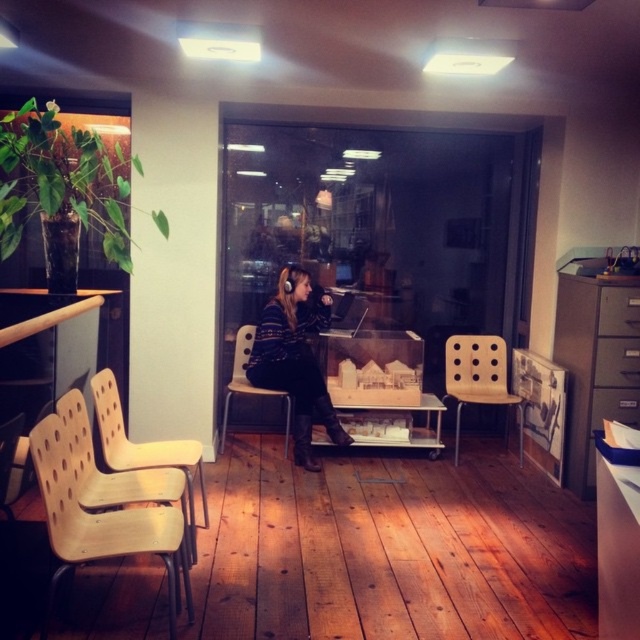
Can you confirm if light brown wood chair at left is positioned above light brown plastic chair at left?

Actually, light brown wood chair at left is below light brown plastic chair at left.

Measure the distance between light brown wood chair at left and camera.

light brown wood chair at left is 3.08 meters from camera.

Between point (200, 454) and point (3, 460), which one is positioned in front?

Point (3, 460) is more forward.

Where is `light brown wood chair at left`? light brown wood chair at left is located at coordinates (145, 445).

Is striped sweater at center taller than light brown wooden chair at right?

Yes, striped sweater at center is taller than light brown wooden chair at right.

Between striped sweater at center and light brown wooden chair at right, which one has more height?

Standing taller between the two is striped sweater at center.

Describe the element at coordinates (296, 358) in the screenshot. I see `striped sweater at center` at that location.

In order to click on striped sweater at center in this screenshot , I will do `click(296, 358)`.

Which of these two, striped sweater at center or wooden perforated chair at center, stands shorter?

wooden perforated chair at center

Is point (296, 360) in front of point (225, 433)?

Yes, point (296, 360) is in front of point (225, 433).

Is point (282, 288) behind point (289, 401)?

No.

Find the location of a particular element. This screenshot has height=640, width=640. striped sweater at center is located at coordinates (x=296, y=358).